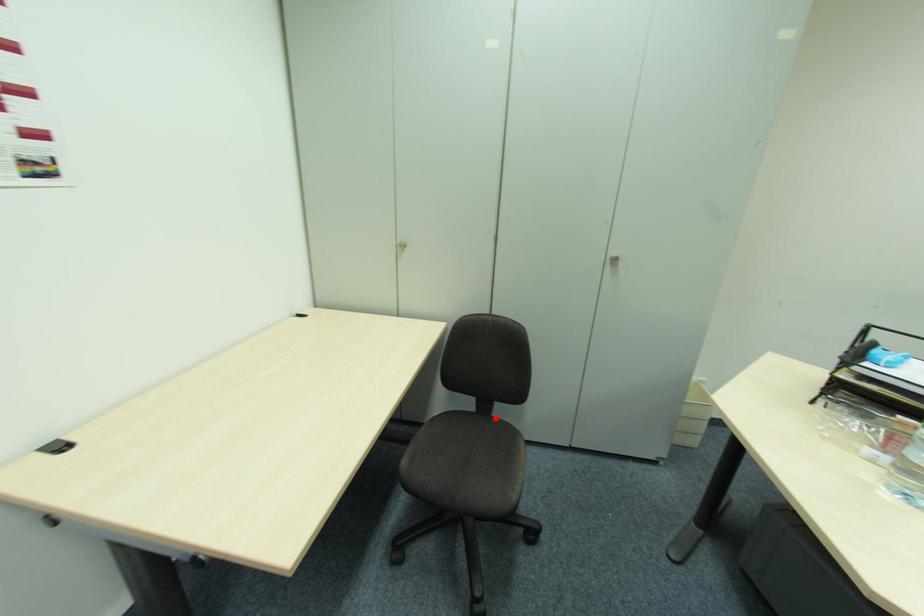
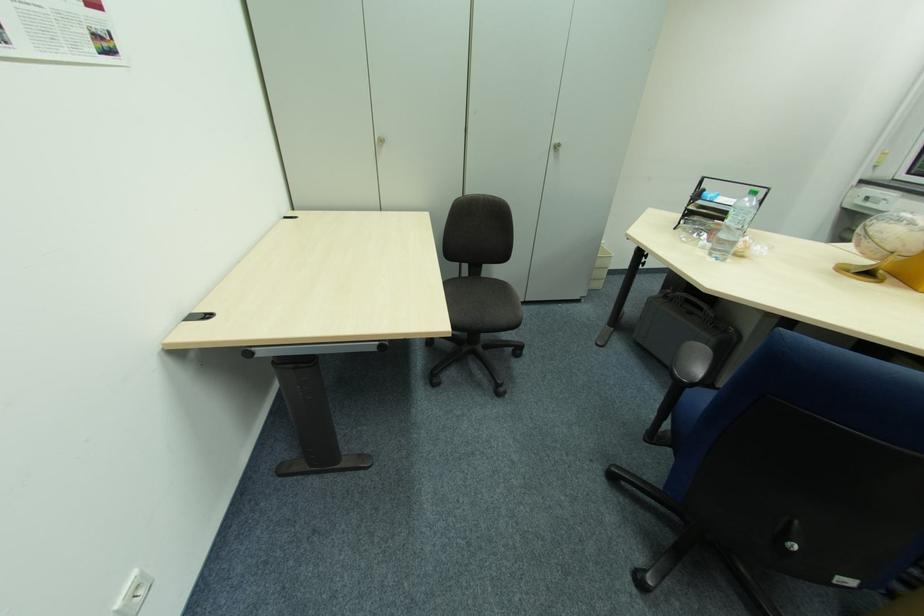
The point at the highlighted location is marked in the first image. Where is the corresponding point in the second image?

(485, 278)